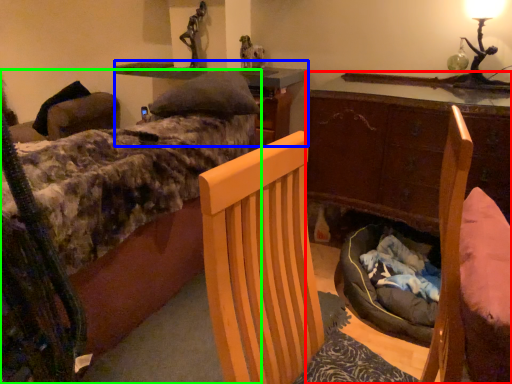
Question: Which is farther away from desk (highlighted by a red box)? computer desk (highlighted by a blue box) or bed (highlighted by a green box)?

Choices:
 (A) computer desk
 (B) bed

Answer: (B)